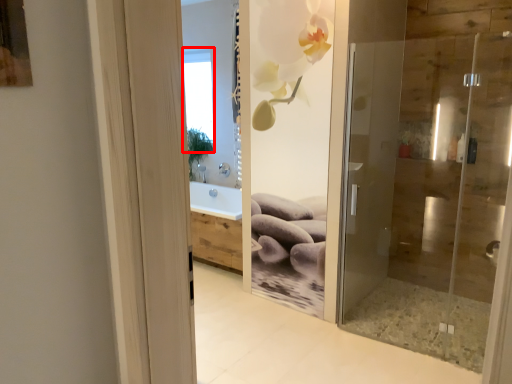
Question: From the image's perspective, what is the correct spatial positioning of window (annotated by the red box) in reference to door?

Choices:
 (A) below
 (B) above

Answer: (B)